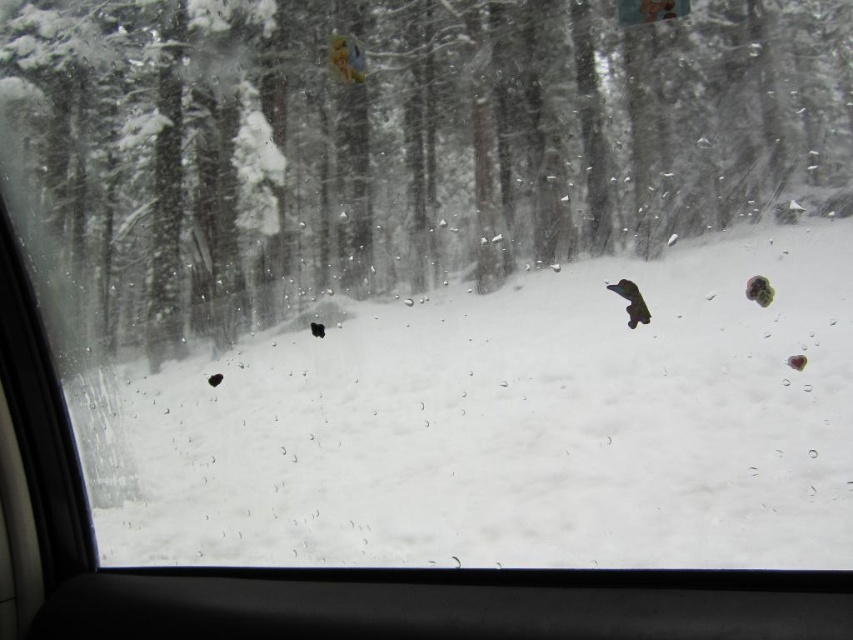
You are a passenger in a car driving through a snowy forest. You notice a snowy bark tree at center and a black matte dog at center outside the window. From your perspective inside the car, which object is positioned to the left?

The snowy bark tree at center is positioned to the left of the black matte dog at center.

You are inside a car with a window covered in water droplets. You notice a point at coordinates (631, 301) on the window. According to the scene description, what object is this point located on?

The point at coordinates (631, 301) is located on the black matte dog at center.

You are driving through a snowy forest and notice a snowy bark tree at center and a black matte dog at center outside your window. Which object is wider?

The snowy bark tree at center is wider than the black matte dog at center because its width surpasses the dog.